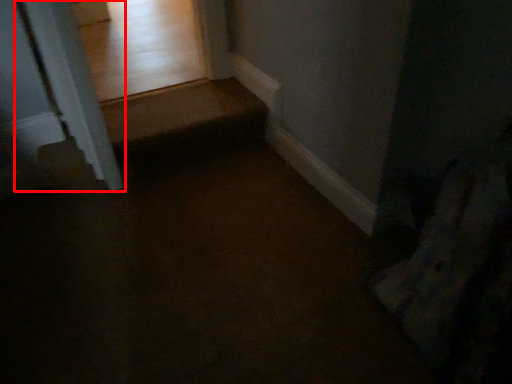
Question: From the image's perspective, what is the correct spatial relationship of pillar (annotated by the red box) in relation to path?

Choices:
 (A) above
 (B) below

Answer: (A)